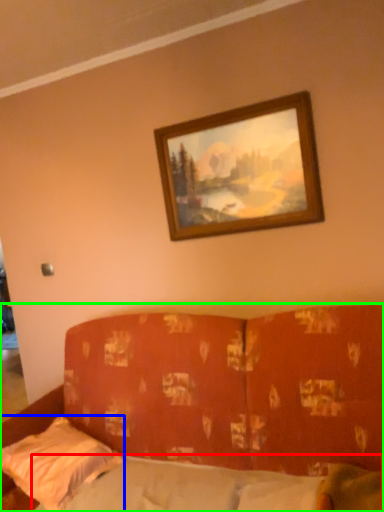
Question: Based on their relative distances, which object is farther from mattress (highlighted by a red box)? Choose from pillow (highlighted by a blue box) and studio couch (highlighted by a green box).

Choices:
 (A) pillow
 (B) studio couch

Answer: (B)